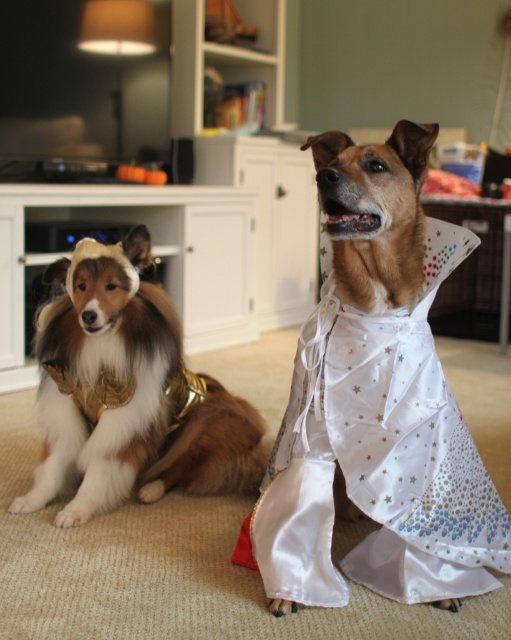
Can you confirm if white satin dress at center is taller than golden fur dog at left?

Yes, white satin dress at center is taller than golden fur dog at left.

Is point (368, 580) positioned before point (211, 452)?

Yes, point (368, 580) is closer to viewer.

What do you see at coordinates (379, 456) in the screenshot?
I see `white satin dress at center` at bounding box center [379, 456].

Locate an element on the screen. white satin dress at center is located at coordinates [x=379, y=456].